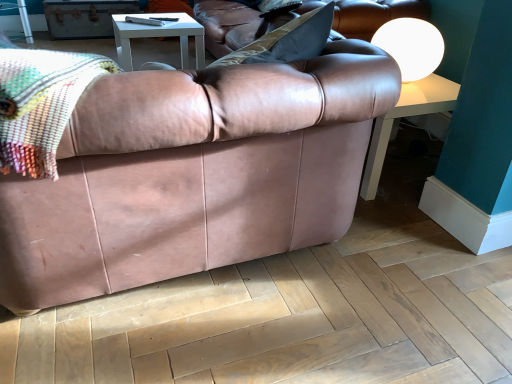
What do you see at coordinates (411, 46) in the screenshot? I see `white matte sphere at upper right` at bounding box center [411, 46].

In order to click on multicolored woven blanket at upper left in this screenshot , I will do `click(41, 104)`.

Where is `matte brown leather couch at center`? matte brown leather couch at center is located at coordinates (194, 174).

Does point (45, 97) come behind point (386, 42)?

No, (45, 97) is in front of (386, 42).

In the image, is multicolored woven blanket at upper left positioned in front of or behind white matte sphere at upper right?

multicolored woven blanket at upper left is positioned closer to the viewer than white matte sphere at upper right.

Is multicolored woven blanket at upper left inside or outside of white matte sphere at upper right?

multicolored woven blanket at upper left is outside white matte sphere at upper right.

Which of these two, multicolored woven blanket at upper left or white matte sphere at upper right, is thinner?

Thinner between the two is white matte sphere at upper right.

Is light brown wood at lower center to the right of matte brown leather couch at center from the viewer's perspective?

Yes, light brown wood at lower center is to the right of matte brown leather couch at center.

Can you confirm if light brown wood at lower center is smaller than matte brown leather couch at center?

Indeed, light brown wood at lower center has a smaller size compared to matte brown leather couch at center.

From their relative heights in the image, would you say light brown wood at lower center is taller or shorter than matte brown leather couch at center?

Considering their sizes, light brown wood at lower center has less height than matte brown leather couch at center.

Find the location of a particular element. studio couch on the left of light brown wood at lower center is located at coordinates (194, 174).

How distant is light brown wood at lower center from white matte sphere at upper right?

light brown wood at lower center and white matte sphere at upper right are 1.06 meters apart from each other.

Is light brown wood at lower center spatially inside white matte sphere at upper right, or outside of it?

light brown wood at lower center is not inside white matte sphere at upper right, it's outside.

Considering the positions of objects light brown wood at lower center and white matte sphere at upper right in the image provided, who is more to the left, light brown wood at lower center or white matte sphere at upper right?

Positioned to the left is light brown wood at lower center.

From the picture: From the image's perspective, is light brown wood at lower center below white matte sphere at upper right?

Yes, from the image's perspective, light brown wood at lower center is below white matte sphere at upper right.

Considering the relative sizes of light brown wood at lower center and multicolored woven blanket at upper left in the image provided, is light brown wood at lower center thinner than multicolored woven blanket at upper left?

Correct, the width of light brown wood at lower center is less than that of multicolored woven blanket at upper left.

Who is taller, light brown wood at lower center or multicolored woven blanket at upper left?

multicolored woven blanket at upper left.

From the image's perspective, does light brown wood at lower center appear higher than multicolored woven blanket at upper left?

No, from the image's perspective, light brown wood at lower center is not above multicolored woven blanket at upper left.

Can you confirm if light brown wood at lower center is bigger than multicolored woven blanket at upper left?

Actually, light brown wood at lower center might be smaller than multicolored woven blanket at upper left.

Looking at this image, does matte brown leather couch at center contain white matte sphere at upper right?

No, white matte sphere at upper right is not inside matte brown leather couch at center.

Is point (314, 90) less distant than point (406, 58)?

That is True.

Are matte brown leather couch at center and white matte sphere at upper right making contact?

matte brown leather couch at center and white matte sphere at upper right are clearly separated.

From the image's perspective, is matte brown leather couch at center above white matte sphere at upper right?

No, from the image's perspective, matte brown leather couch at center is not on top of white matte sphere at upper right.

From their relative heights in the image, would you say matte brown leather couch at center is taller or shorter than light brown wood at lower center?

Considering their sizes, matte brown leather couch at center has more height than light brown wood at lower center.

Is matte brown leather couch at center placed right next to light brown wood at lower center?

matte brown leather couch at center and light brown wood at lower center are not in contact.

Is matte brown leather couch at center wider than light brown wood at lower center?

Correct, the width of matte brown leather couch at center exceeds that of light brown wood at lower center.

Would you consider multicolored woven blanket at upper left to be distant from light brown wood at lower center?

No, multicolored woven blanket at upper left is not far away from light brown wood at lower center.

Is light brown wood at lower center a part of multicolored woven blanket at upper left?

No, light brown wood at lower center is not a part of multicolored woven blanket at upper left.

From the picture: Is multicolored woven blanket at upper left taller or shorter than light brown wood at lower center?

Considering their sizes, multicolored woven blanket at upper left has more height than light brown wood at lower center.

Is multicolored woven blanket at upper left oriented towards light brown wood at lower center?

No, multicolored woven blanket at upper left does not turn towards light brown wood at lower center.

Where is `blanket above the white matte sphere at upper right (from a real-world perspective)`? blanket above the white matte sphere at upper right (from a real-world perspective) is located at coordinates (41, 104).

The width and height of the screenshot is (512, 384). Find the location of `plywood located on the right of matte brown leather couch at center`. plywood located on the right of matte brown leather couch at center is located at coordinates (290, 319).

Based on the photo, estimate the real-world distances between objects in this image. Which object is further from matte brown leather couch at center, white matte sphere at upper right or light brown wood at lower center?

Among the two, white matte sphere at upper right is located further to matte brown leather couch at center.

From the image, which object appears to be farther from multicolored woven blanket at upper left, white matte sphere at upper right or matte brown leather couch at center?

white matte sphere at upper right is positioned further to the anchor multicolored woven blanket at upper left.

Consider the image. From the image, which object appears to be farther from light brown wood at lower center, multicolored woven blanket at upper left or matte brown leather couch at center?

multicolored woven blanket at upper left is positioned further to the anchor light brown wood at lower center.

Based on their spatial positions, is matte brown leather couch at center or multicolored woven blanket at upper left closer to light brown wood at lower center?

The object closer to light brown wood at lower center is matte brown leather couch at center.

Which object lies further to the anchor point light brown wood at lower center, matte brown leather couch at center or white matte sphere at upper right?

white matte sphere at upper right is further to light brown wood at lower center.

Based on their spatial positions, is multicolored woven blanket at upper left or white matte sphere at upper right closer to matte brown leather couch at center?

multicolored woven blanket at upper left lies closer to matte brown leather couch at center than the other object.

From the picture: Based on their spatial positions, is white matte sphere at upper right or multicolored woven blanket at upper left closer to light brown wood at lower center?

multicolored woven blanket at upper left is closer to light brown wood at lower center.

Which object lies further to the anchor point multicolored woven blanket at upper left, white matte sphere at upper right or light brown wood at lower center?

The object further to multicolored woven blanket at upper left is white matte sphere at upper right.

At what (x,y) coordinates should I click in order to perform the action: click on studio couch between multicolored woven blanket at upper left and light brown wood at lower center in the vertical direction. Please return your answer as a coordinate pair (x, y). Looking at the image, I should click on (194, 174).

Where is `plywood situated between multicolored woven blanket at upper left and white matte sphere at upper right from left to right`? The width and height of the screenshot is (512, 384). plywood situated between multicolored woven blanket at upper left and white matte sphere at upper right from left to right is located at coordinates (290, 319).

Find the location of a particular element. plywood situated between matte brown leather couch at center and white matte sphere at upper right from left to right is located at coordinates (290, 319).

Find the location of a particular element. Image resolution: width=512 pixels, height=384 pixels. studio couch located between multicolored woven blanket at upper left and white matte sphere at upper right in the left-right direction is located at coordinates point(194,174).